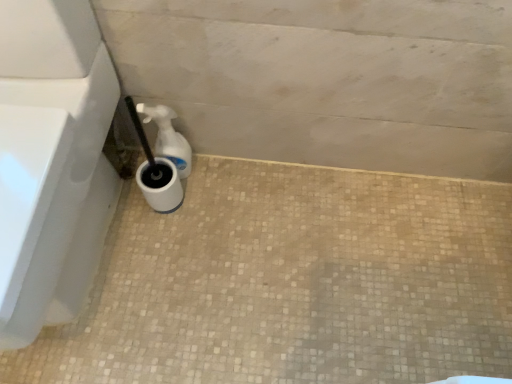
Question: Can you confirm if white glossy toilet at lower left is taller than white matte concrete at lower center?

Choices:
 (A) yes
 (B) no

Answer: (A)

Question: Is white glossy toilet at lower left to the right of white matte concrete at lower center from the viewer's perspective?

Choices:
 (A) yes
 (B) no

Answer: (B)

Question: Does white glossy toilet at lower left have a greater width compared to white matte concrete at lower center?

Choices:
 (A) no
 (B) yes

Answer: (A)

Question: Is white glossy toilet at lower left in front of white matte concrete at lower center?

Choices:
 (A) yes
 (B) no

Answer: (A)

Question: From a real-world perspective, is white glossy toilet at lower left beneath white matte concrete at lower center?

Choices:
 (A) no
 (B) yes

Answer: (A)

Question: From a real-world perspective, is white matte concrete at lower center physically located above or below white glossy toilet at lower left?

Choices:
 (A) above
 (B) below

Answer: (B)

Question: Would you say white matte concrete at lower center is to the left or to the right of white glossy toilet at lower left in the picture?

Choices:
 (A) right
 (B) left

Answer: (A)

Question: Looking at their shapes, would you say white matte concrete at lower center is wider or thinner than white glossy toilet at lower left?

Choices:
 (A) thin
 (B) wide

Answer: (B)

Question: In terms of height, does white matte concrete at lower center look taller or shorter compared to white glossy toilet at lower left?

Choices:
 (A) tall
 (B) short

Answer: (B)

Question: Would you say white plastic spray bottle at lower left is inside or outside white glossy toilet at lower left?

Choices:
 (A) inside
 (B) outside

Answer: (B)

Question: In terms of width, does white plastic spray bottle at lower left look wider or thinner when compared to white glossy toilet at lower left?

Choices:
 (A) wide
 (B) thin

Answer: (B)

Question: Is white plastic spray bottle at lower left taller or shorter than white glossy toilet at lower left?

Choices:
 (A) short
 (B) tall

Answer: (A)

Question: Would you say white plastic spray bottle at lower left is to the left or to the right of white glossy toilet at lower left in the picture?

Choices:
 (A) left
 (B) right

Answer: (B)

Question: From a real-world perspective, is white matte concrete at lower center physically located above or below white plastic spray bottle at lower left?

Choices:
 (A) below
 (B) above

Answer: (A)

Question: Choose the correct answer: Is white matte concrete at lower center inside white plastic spray bottle at lower left or outside it?

Choices:
 (A) inside
 (B) outside

Answer: (B)